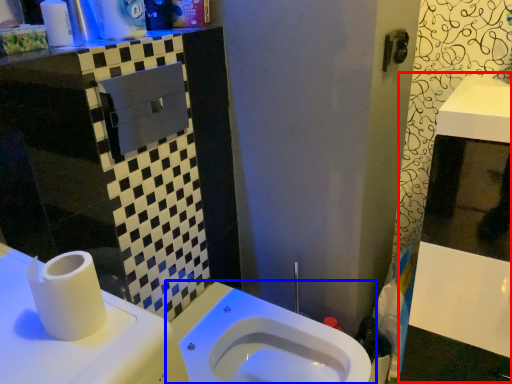
Question: Which point is closer to the camera, medicine cabinet (highlighted by a red box) or toilet (highlighted by a blue box)?

Choices:
 (A) medicine cabinet
 (B) toilet

Answer: (A)